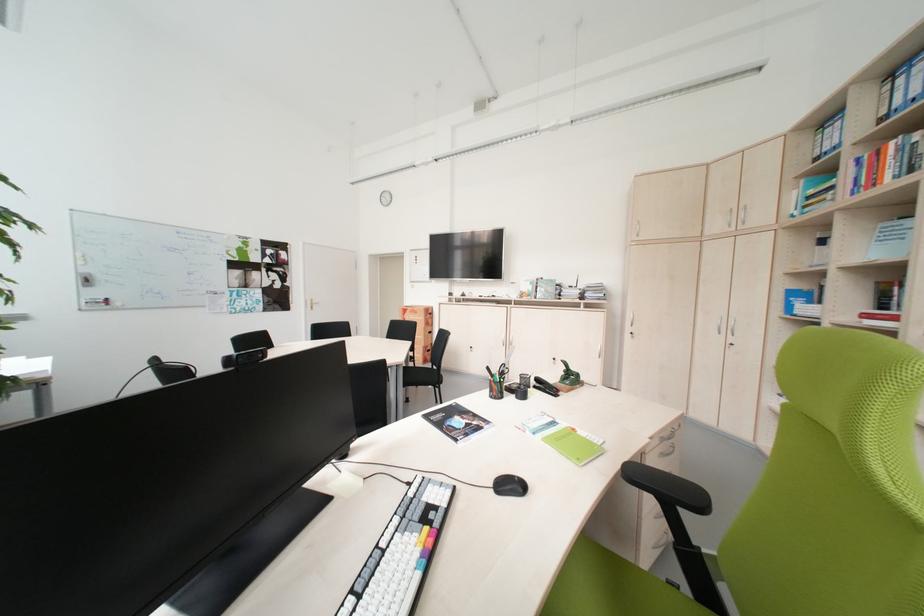
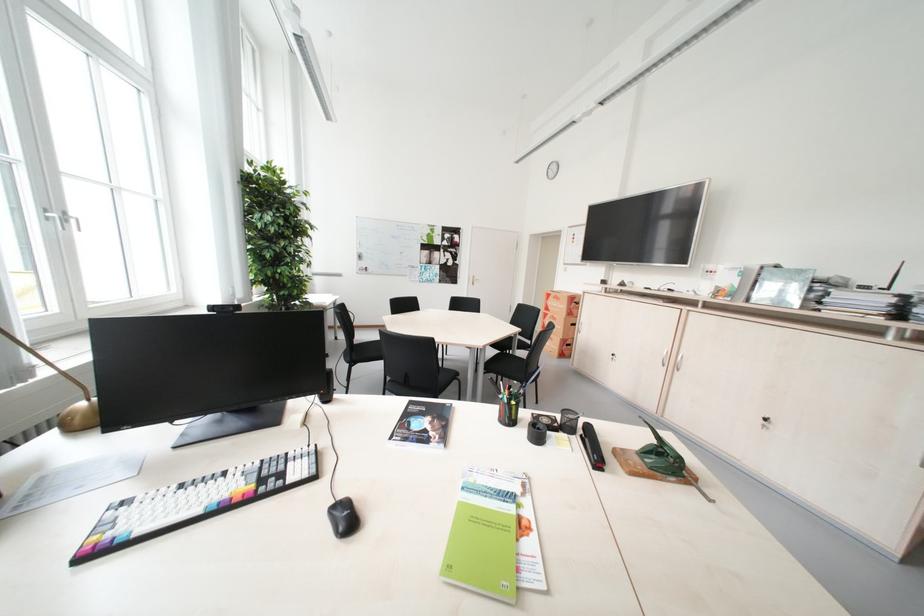
In the second image, find the point that corresponds to pixel 307 299 in the first image.

(473, 275)